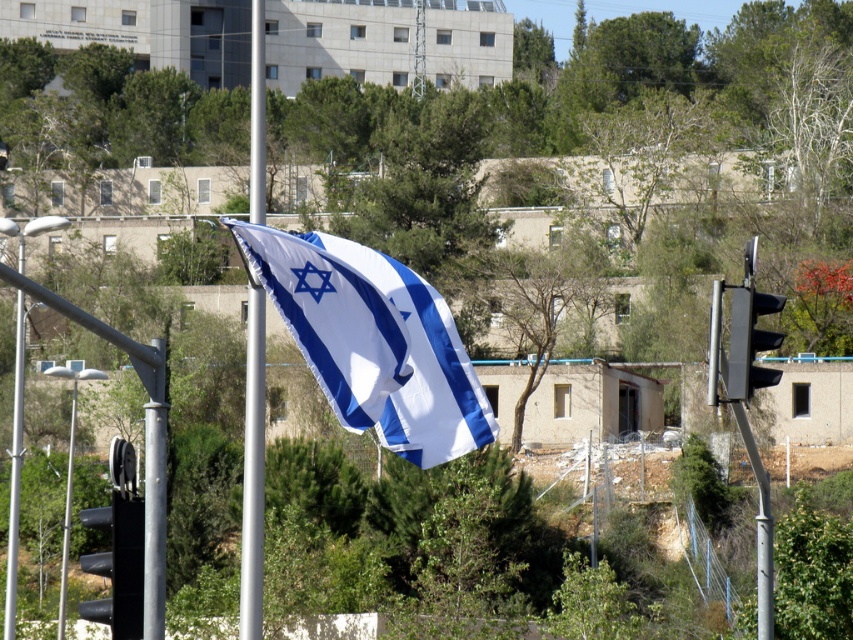
Question: Is silver metallic flag pole at center positioned at the back of metallic silver streetlight at left?

Choices:
 (A) yes
 (B) no

Answer: (B)

Question: Can you confirm if silver metallic flag pole at center is positioned to the right of metallic gray pole at left?

Choices:
 (A) no
 (B) yes

Answer: (B)

Question: Estimate the real-world distances between objects in this image. Which object is closer to the white and blue fabric flag at center?

Choices:
 (A) metallic gray pole at left
 (B) silver metallic flag pole at center
 (C) metallic silver streetlight at left

Answer: (B)

Question: Which object is farther from the camera taking this photo?

Choices:
 (A) metallic silver streetlight at left
 (B) white and blue fabric flag at center
 (C) silver metallic flag pole at center
 (D) metallic gray pole at left

Answer: (D)

Question: Which of the following is the closest to the observer?

Choices:
 (A) metallic gray pole at left
 (B) metallic silver streetlight at left
 (C) white and blue fabric flag at center
 (D) silver metallic flag pole at center

Answer: (C)

Question: Does silver metallic flag pole at center appear over metallic silver streetlight at left?

Choices:
 (A) no
 (B) yes

Answer: (B)